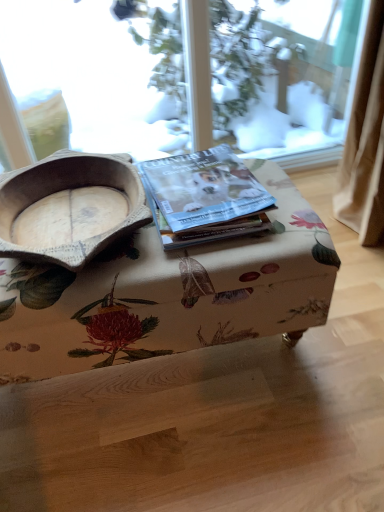
Locate an element on the screen. The width and height of the screenshot is (384, 512). matte paper magazine at center is located at coordinates (204, 197).

Which is correct: floral fabric ottoman at center is inside wooden bowl at left, or outside of it?

floral fabric ottoman at center is not inside wooden bowl at left, it's outside.

Is floral fabric ottoman at center oriented towards wooden bowl at left?

No, floral fabric ottoman at center is not facing towards wooden bowl at left.

In the image, is floral fabric ottoman at center on the left side or the right side of wooden bowl at left?

Based on their positions, floral fabric ottoman at center is located to the right of wooden bowl at left.

Consider the image. From the image's perspective, is floral fabric ottoman at center under matte paper magazine at center?

Correct, floral fabric ottoman at center appears lower than matte paper magazine at center in the image.

Which of these two, floral fabric ottoman at center or matte paper magazine at center, stands shorter?

With less height is matte paper magazine at center.

Is floral fabric ottoman at center bigger or smaller than matte paper magazine at center?

Considering their sizes, floral fabric ottoman at center takes up more space than matte paper magazine at center.

Which of these two, matte paper magazine at center or wooden bowl at left, stands taller?

wooden bowl at left.

From the image's perspective, which one is positioned higher, matte paper magazine at center or wooden bowl at left?

matte paper magazine at center.

From a real-world perspective, between matte paper magazine at center and wooden bowl at left, who is vertically higher?

wooden bowl at left.

Measure the distance between matte paper magazine at center and wooden bowl at left.

matte paper magazine at center and wooden bowl at left are 6.23 inches apart from each other.

Are wooden bowl at left and matte paper magazine at center far apart?

No, there isn't a large distance between wooden bowl at left and matte paper magazine at center.

From a real-world perspective, which object stands above the other?

In real-world perspective, wooden bowl at left is above.

Between wooden bowl at left and matte paper magazine at center, which one is positioned in front?

Positioned in front is wooden bowl at left.

Is matte paper magazine at center directly adjacent to floral fabric ottoman at center?

No, matte paper magazine at center is not next to floral fabric ottoman at center.

There is a floral fabric ottoman at center. Where is `paperback book above it (from a real-world perspective)`? The height and width of the screenshot is (512, 384). paperback book above it (from a real-world perspective) is located at coordinates [204, 197].

Would you say matte paper magazine at center is inside or outside floral fabric ottoman at center?

matte paper magazine at center is located beyond the bounds of floral fabric ottoman at center.

Looking at this image, does matte paper magazine at center have a lesser height compared to floral fabric ottoman at center?

Correct, matte paper magazine at center is not as tall as floral fabric ottoman at center.

Relative to floral fabric ottoman at center, is wooden bowl at left in front or behind?

Clearly, wooden bowl at left is in front of floral fabric ottoman at center.

Considering the relative sizes of wooden bowl at left and floral fabric ottoman at center in the image provided, is wooden bowl at left thinner than floral fabric ottoman at center?

No.

Is wooden bowl at left bigger or smaller than floral fabric ottoman at center?

Considering their sizes, wooden bowl at left takes up less space than floral fabric ottoman at center.

From a real-world perspective, relative to floral fabric ottoman at center, is wooden bowl at left vertically above or below?

wooden bowl at left is situated higher than floral fabric ottoman at center in the real world.

Locate an element on the screen. The height and width of the screenshot is (512, 384). table on the right side of wooden bowl at left is located at coordinates (168, 294).

Find the location of a particular element. The width and height of the screenshot is (384, 512). table that is below the matte paper magazine at center (from the image's perspective) is located at coordinates (168, 294).

Considering their positions, is floral fabric ottoman at center positioned closer to wooden bowl at left than matte paper magazine at center?

matte paper magazine at center is closer to wooden bowl at left.

Looking at the image, which one is located closer to wooden bowl at left, matte paper magazine at center or floral fabric ottoman at center?

Among the two, matte paper magazine at center is located nearer to wooden bowl at left.

From the picture: Estimate the real-world distances between objects in this image. Which object is further from matte paper magazine at center, floral fabric ottoman at center or wooden bowl at left?

Among the two, wooden bowl at left is located further to matte paper magazine at center.

In the scene shown: From the image, which object appears to be nearer to floral fabric ottoman at center, wooden bowl at left or matte paper magazine at center?

matte paper magazine at center.

Which object lies nearer to the anchor point matte paper magazine at center, wooden bowl at left or floral fabric ottoman at center?

The object closer to matte paper magazine at center is floral fabric ottoman at center.

When comparing their distances from floral fabric ottoman at center, does matte paper magazine at center or wooden bowl at left seem further?

wooden bowl at left is further to floral fabric ottoman at center.

You are a GUI agent. You are given a task and a screenshot of the screen. Output one action in this format:
    pyautogui.click(x=<x>, y=<y>)
    Task: Click on the table situated between wooden bowl at left and matte paper magazine at center from left to right
    
    Given the screenshot: What is the action you would take?
    pyautogui.click(x=168, y=294)